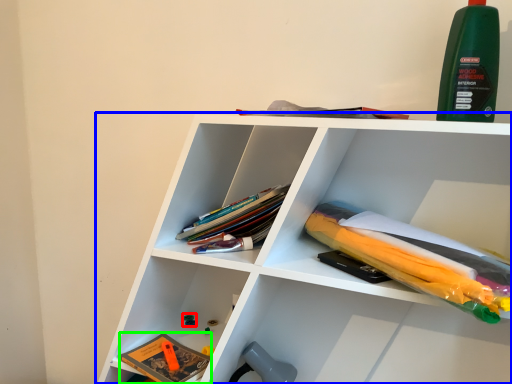
Question: Which object is the closest to the toy (highlighted by a red box)? Choose among these: shelf (highlighted by a blue box) or book (highlighted by a green box).

Choices:
 (A) shelf
 (B) book

Answer: (B)